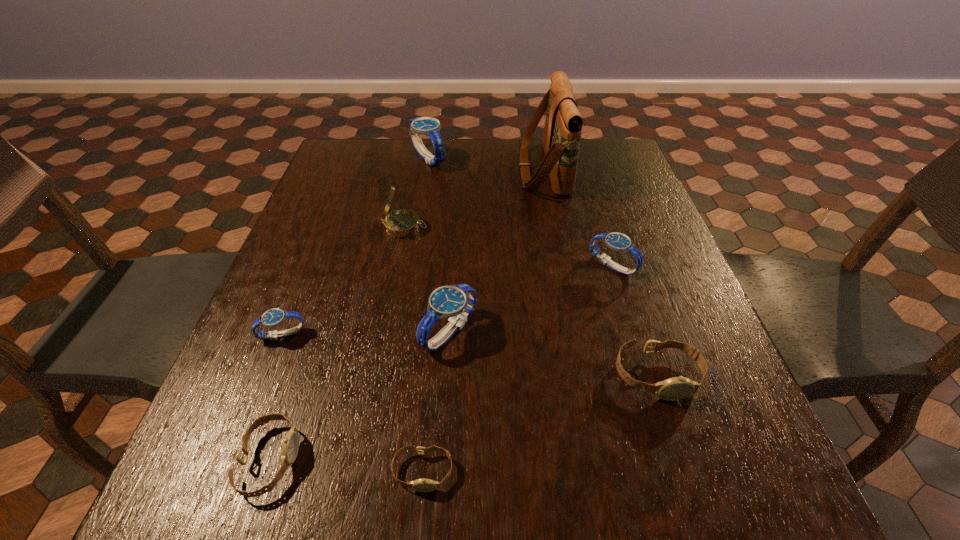
At what (x,y) coordinates should I click in order to perform the action: click on blank space located on the back of the rightmost blue watch. Please return your answer as a coordinate pair (x, y). The image size is (960, 540). Looking at the image, I should click on (586, 181).

Image resolution: width=960 pixels, height=540 pixels. Identify the location of vacant space located 0.140m on the face of the rightmost beige watch. (693, 487).

Where is `vacant space located 0.210m on the right of the leftmost blue watch`? Image resolution: width=960 pixels, height=540 pixels. vacant space located 0.210m on the right of the leftmost blue watch is located at coordinates (414, 335).

Locate an element on the screen. This screenshot has height=540, width=960. vacant space located 0.230m on the face of the leftmost beige watch is located at coordinates (445, 460).

Where is `shoulder bag present at the far edge`? shoulder bag present at the far edge is located at coordinates (562, 132).

What are the coordinates of `watch that is at the far edge` in the screenshot? It's located at (428, 126).

Where is `object present at the near left corner`? object present at the near left corner is located at coordinates (290, 446).

Locate an element on the screen. Image resolution: width=960 pixels, height=540 pixels. blank space at the far edge of the desktop is located at coordinates (455, 163).

Locate an element on the screen. This screenshot has width=960, height=540. vacant space at the near edge of the desktop is located at coordinates (651, 489).

Locate an element on the screen. free region at the left edge is located at coordinates (322, 204).